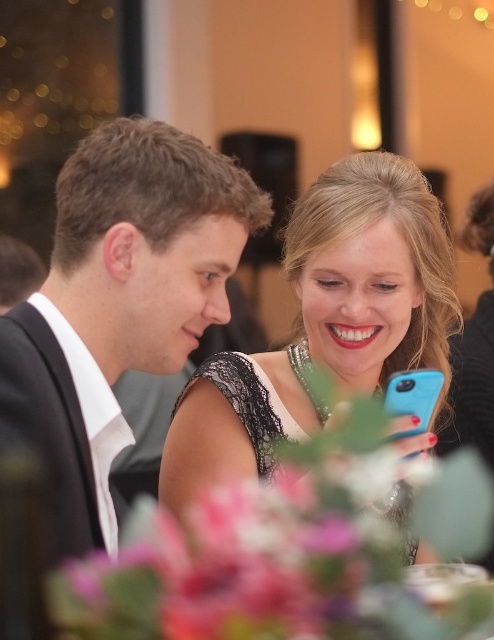
You are a photographer at the event and need to adjust the lighting to ensure both the black satin suit at left and the matte black dress at center are equally visible. Considering their heights, which object should you focus on first to balance the exposure?

The black satin suit at left has a lesser height compared to matte black dress at center, so you should focus on the matte black dress at center first to ensure proper exposure for the taller object before adjusting for the shorter one.

You are a photographer at a formal event. You need to capture a photo of both the black satin suit at left and the matte black dress at center. Which of the two clothing items will appear larger in the final photo?

The matte black dress at center will appear larger in the final photo because it is larger than the black satin suit at left.